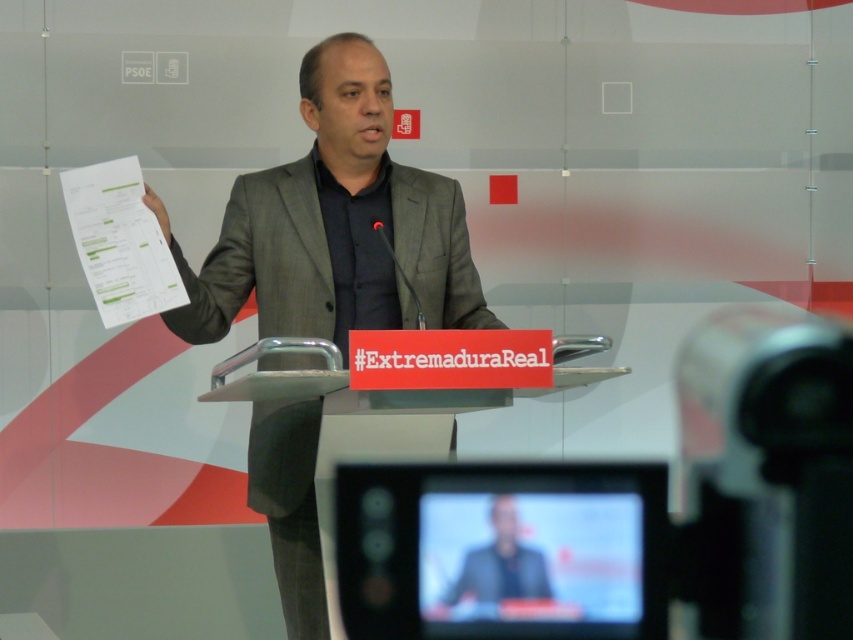
What are the coordinates of the gray suit at center in the image?

The gray suit at center is located at coordinates point (x=334, y=225).